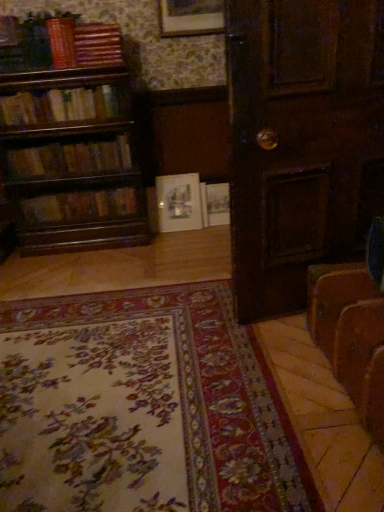
This screenshot has width=384, height=512. I want to click on free area below wooden bookshelf at left, the fourth book when ordered from top to bottom (from a real-world perspective), so click(87, 188).